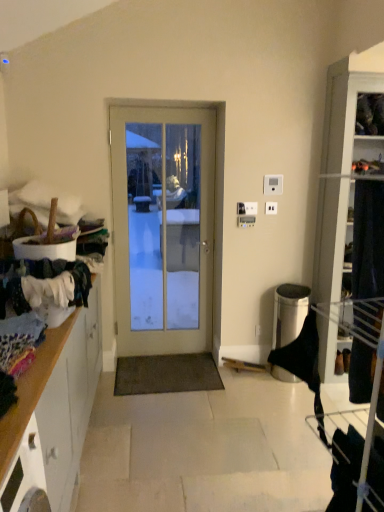
Question: Based on their sizes in the image, would you say white plastic light switch at upper center, which appears as the 1th light switch when viewed from the left, is bigger or smaller than white plastic light switch at upper center, acting as the first light switch starting from the right?

Choices:
 (A) big
 (B) small

Answer: (A)

Question: Is white plastic light switch at upper center, marked as the 1th light switch in a bottom-to-top arrangement, in front of or behind white plastic light switch at upper center, which is the 2th light switch in left-to-right order, in the image?

Choices:
 (A) front
 (B) behind

Answer: (B)

Question: Based on their relative distances, which object is nearer to the wooden cabinet at left?

Choices:
 (A) white glass door at center
 (B) white plastic light switch at upper center, which is the 2th light switch in left-to-right order
 (C) white plastic electric outlet at center
 (D) white plastic light switch at upper center, marked as the 1th light switch in a bottom-to-top arrangement

Answer: (A)

Question: Considering the real-world distances, which object is closest to the white plastic light switch at upper center, acting as the first light switch starting from the right?

Choices:
 (A) white glass door at center
 (B) white plastic electric outlet at center
 (C) white plastic light switch at upper center, which appears as the 1th light switch when viewed from the left
 (D) wooden cabinet at left

Answer: (B)